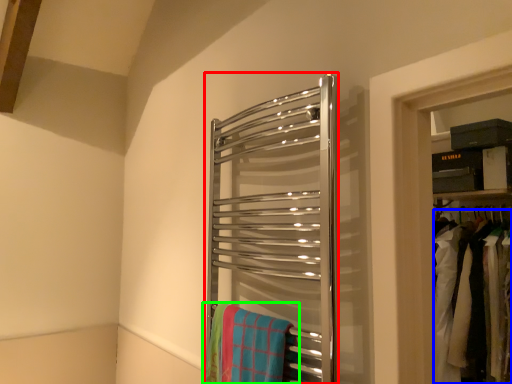
Question: Which object is the farthest from towel rack (highlighted by a red box)? Choose among these: laundry (highlighted by a blue box) or beach towel (highlighted by a green box).

Choices:
 (A) laundry
 (B) beach towel

Answer: (A)